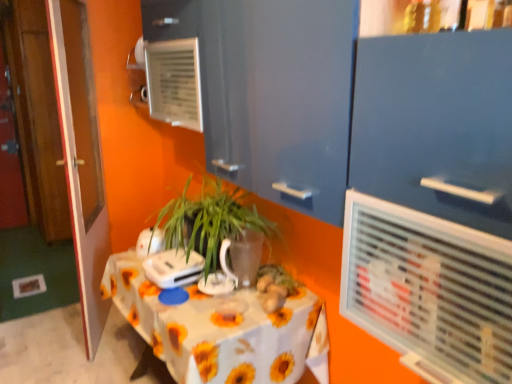
This screenshot has width=512, height=384. What do you see at coordinates (242, 257) in the screenshot?
I see `translucent glass vase at center` at bounding box center [242, 257].

You are a GUI agent. You are given a task and a screenshot of the screen. Output one action in this format:
    pyautogui.click(x=<x>, y=<y>)
    Task: Click on the white glossy table at center
    Image resolution: width=512 pixels, height=384 pixels.
    Given the screenshot: What is the action you would take?
    pyautogui.click(x=221, y=330)

What do you see at coordinates (208, 224) in the screenshot? The image size is (512, 384). I see `green leafy plant at center` at bounding box center [208, 224].

Where is `white plastic appliance at center, arranged as the 1th appliance when viewed from the front`? The width and height of the screenshot is (512, 384). white plastic appliance at center, arranged as the 1th appliance when viewed from the front is located at coordinates coord(173,268).

Where is `white glossy kettle at upper center, which is the first appliance in back-to-front order`? white glossy kettle at upper center, which is the first appliance in back-to-front order is located at coordinates (150, 242).

Would you say white glossy kettle at upper center, placed as the 2th appliance when sorted from front to back, is outside green leafy plant at center?

Yes, white glossy kettle at upper center, placed as the 2th appliance when sorted from front to back, is located beyond the bounds of green leafy plant at center.

Between white glossy kettle at upper center, placed as the 2th appliance when sorted from front to back, and green leafy plant at center, which one has larger size?

Bigger between the two is green leafy plant at center.

Can you confirm if white glossy kettle at upper center, placed as the 2th appliance when sorted from front to back, is shorter than green leafy plant at center?

Indeed, white glossy kettle at upper center, placed as the 2th appliance when sorted from front to back, has a lesser height compared to green leafy plant at center.

Is wooden door at left facing away from white glossy kettle at upper center, which is the first appliance in back-to-front order?

No, wooden door at left's orientation is not away from white glossy kettle at upper center, which is the first appliance in back-to-front order.

Can you confirm if wooden door at left is bigger than white glossy kettle at upper center, which is the first appliance in back-to-front order?

Yes.

Is wooden door at left inside the boundaries of white glossy kettle at upper center, which is the first appliance in back-to-front order, or outside?

wooden door at left exists outside the volume of white glossy kettle at upper center, which is the first appliance in back-to-front order.

Which is behind, point (94, 219) or point (150, 238)?

Point (94, 219)

From the image's perspective, which is below, matte blue cabinet at upper center or white glossy kettle at upper center, which is the first appliance in back-to-front order?

white glossy kettle at upper center, which is the first appliance in back-to-front order, appears lower in the image.

Which of these two, matte blue cabinet at upper center or white glossy kettle at upper center, which is the first appliance in back-to-front order, is smaller?

white glossy kettle at upper center, which is the first appliance in back-to-front order.

Is matte blue cabinet at upper center directly adjacent to white glossy kettle at upper center, which is the first appliance in back-to-front order?

No, matte blue cabinet at upper center is not next to white glossy kettle at upper center, which is the first appliance in back-to-front order.

Which object is further away from the camera taking this photo, matte blue cabinet at upper center or white glossy kettle at upper center, which is the first appliance in back-to-front order?

white glossy kettle at upper center, which is the first appliance in back-to-front order, is further from the camera.

Between white plastic appliance at center, arranged as the 1th appliance when viewed from the front, and white glossy table at center, which one appears on the left side from the viewer's perspective?

white plastic appliance at center, arranged as the 1th appliance when viewed from the front.

Find the location of a particular element. The height and width of the screenshot is (384, 512). table below the white plastic appliance at center, arranged as the 1th appliance when viewed from the front (from a real-world perspective) is located at coordinates (221, 330).

From a real-world perspective, is white plastic appliance at center, the 2th appliance viewed from the back, below white glossy table at center?

Incorrect, from a real-world perspective, white plastic appliance at center, the 2th appliance viewed from the back, is higher than white glossy table at center.

Does point (153, 258) come closer to viewer compared to point (325, 363)?

No, it is not.

Is white plastic appliance at center, the 2th appliance viewed from the back, at the left side of white plastic air conditioning unit at upper center?

Indeed, white plastic appliance at center, the 2th appliance viewed from the back, is positioned on the left side of white plastic air conditioning unit at upper center.

From the picture: Do you think white plastic appliance at center, the 2th appliance viewed from the back, is within white plastic air conditioning unit at upper center, or outside of it?

white plastic appliance at center, the 2th appliance viewed from the back, is spatially situated outside white plastic air conditioning unit at upper center.

From the image's perspective, which is above, white plastic appliance at center, the 2th appliance viewed from the back, or white plastic air conditioning unit at upper center?

white plastic air conditioning unit at upper center is shown above in the image.

At what (x,y) coordinates should I click in order to perform the action: click on air conditioning located in front of the white plastic appliance at center, the 2th appliance viewed from the back. Please return your answer as a coordinate pair (x, y). This screenshot has height=384, width=512. Looking at the image, I should click on (429, 290).

Where is `houseplant in front of the wooden door at left`? The width and height of the screenshot is (512, 384). houseplant in front of the wooden door at left is located at coordinates (208, 224).

Can you tell me how much wooden door at left and green leafy plant at center differ in facing direction?

29.7 degrees.

From the image's perspective, which is below, wooden door at left or green leafy plant at center?

green leafy plant at center.

Is wooden door at left not near green leafy plant at center?

Actually, wooden door at left and green leafy plant at center are a little close together.

In terms of height, does translucent glass vase at center look taller or shorter compared to wooden door at left?

Considering their sizes, translucent glass vase at center has less height than wooden door at left.

Is translucent glass vase at center in contact with wooden door at left?

There is a gap between translucent glass vase at center and wooden door at left.

How different are the orientations of translucent glass vase at center and wooden door at left in degrees?

translucent glass vase at center and wooden door at left are facing 152 degrees away from each other.

Is point (238, 268) positioned behind point (87, 245)?

That is False.

Image resolution: width=512 pixels, height=384 pixels. I want to click on houseplant on the right of the white glossy kettle at upper center, placed as the 2th appliance when sorted from front to back, so click(x=208, y=224).

I want to click on door lying on the left of white glossy kettle at upper center, placed as the 2th appliance when sorted from front to back, so click(81, 157).

Looking at the image, which one is located closer to translucent glass vase at center, matte blue cabinet at upper center or white plastic air conditioning unit at upper center?

white plastic air conditioning unit at upper center is positioned closer to the anchor translucent glass vase at center.

From the image, which object appears to be nearer to white glossy kettle at upper center, placed as the 2th appliance when sorted from front to back, white glossy table at center or green leafy plant at center?

The object closer to white glossy kettle at upper center, placed as the 2th appliance when sorted from front to back, is green leafy plant at center.

From the image, which object appears to be farther from white plastic air conditioning unit at upper center, green leafy plant at center or wooden door at left?

The object further to white plastic air conditioning unit at upper center is wooden door at left.

Based on their spatial positions, is white glossy kettle at upper center, which is the first appliance in back-to-front order, or translucent glass vase at center closer to wooden door at left?

Based on the image, white glossy kettle at upper center, which is the first appliance in back-to-front order, appears to be nearer to wooden door at left.

When comparing their distances from matte blue cabinet at upper center, does translucent glass vase at center or green leafy plant at center seem closer?

Based on the image, translucent glass vase at center appears to be nearer to matte blue cabinet at upper center.

Which object lies further to the anchor point white plastic appliance at center, arranged as the 1th appliance when viewed from the front, white plastic air conditioning unit at upper center or wooden door at left?

white plastic air conditioning unit at upper center.

Considering their positions, is matte blue cabinet at upper center positioned closer to translucent glass vase at center than white plastic appliance at center, the 2th appliance viewed from the back?

Among the two, white plastic appliance at center, the 2th appliance viewed from the back, is located nearer to translucent glass vase at center.

When comparing their distances from white glossy table at center, does white plastic appliance at center, the 2th appliance viewed from the back, or white glossy kettle at upper center, which is the first appliance in back-to-front order, seem closer?

The object closer to white glossy table at center is white plastic appliance at center, the 2th appliance viewed from the back.

At what (x,y) coordinates should I click in order to perform the action: click on flowerpot between green leafy plant at center and white glossy kettle at upper center, placed as the 2th appliance when sorted from front to back, along the z-axis. Please return your answer as a coordinate pair (x, y). Looking at the image, I should click on (242, 257).

The height and width of the screenshot is (384, 512). Find the location of `table between wooden door at left and white plastic air conditioning unit at upper center`. table between wooden door at left and white plastic air conditioning unit at upper center is located at coordinates (221, 330).

You are a GUI agent. You are given a task and a screenshot of the screen. Output one action in this format:
    pyautogui.click(x=<x>, y=<y>)
    Task: Click on the appliance situated between wooden door at left and white plastic appliance at center, the 2th appliance viewed from the back, from left to right
    This screenshot has width=512, height=384.
    Given the screenshot: What is the action you would take?
    pyautogui.click(x=150, y=242)

Locate an element on the screen. flowerpot between matte blue cabinet at upper center and white plastic appliance at center, arranged as the 1th appliance when viewed from the front, in the front-back direction is located at coordinates coord(242,257).